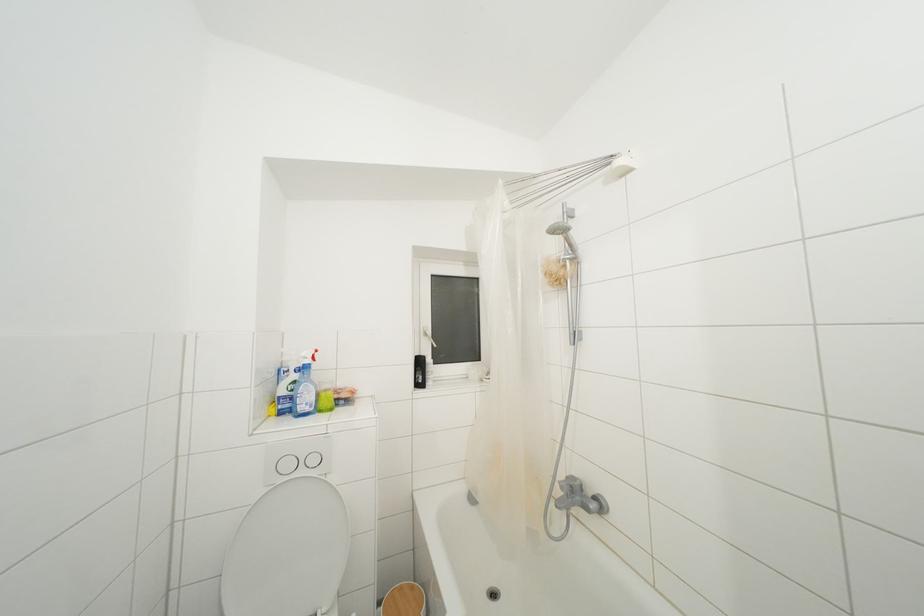
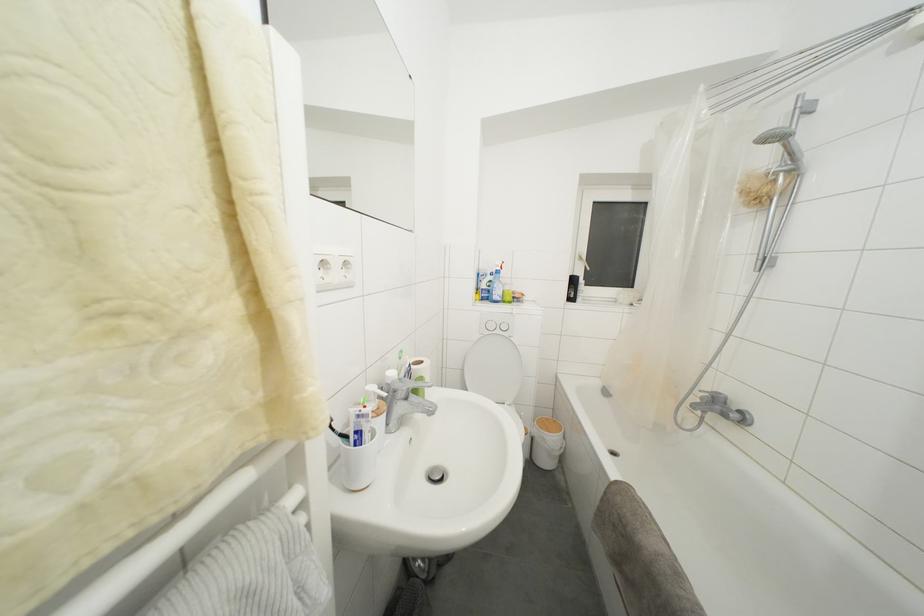
In the second image, find the point that corresponds to (x=423, y=367) in the first image.

(578, 286)